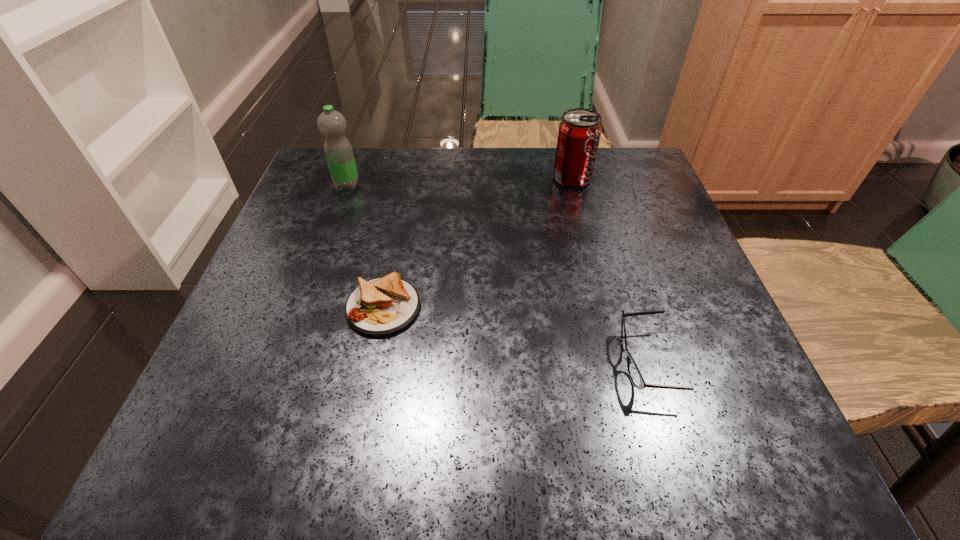
You are a GUI agent. You are given a task and a screenshot of the screen. Output one action in this format:
    pyautogui.click(x=<x>, y=<y>)
    Task: Click on the free space located on the front-facing side of the spectacles
    
    Given the screenshot: What is the action you would take?
    pyautogui.click(x=456, y=362)

At what (x,y) coordinates should I click in order to perform the action: click on free region located on the right of the shortest object. Please return your answer as a coordinate pair (x, y). Looking at the image, I should click on (488, 308).

Where is `water bottle that is at the far edge`? This screenshot has height=540, width=960. water bottle that is at the far edge is located at coordinates (332, 124).

Locate an element on the screen. This screenshot has height=540, width=960. pop soda at the far edge is located at coordinates [579, 132].

Image resolution: width=960 pixels, height=540 pixels. In order to click on object present at the left edge in this screenshot , I will do `click(332, 124)`.

Find the location of a particular element. The height and width of the screenshot is (540, 960). pop soda situated at the right edge is located at coordinates (579, 132).

Where is `spectacles positioned at the right edge`? The width and height of the screenshot is (960, 540). spectacles positioned at the right edge is located at coordinates (635, 375).

Locate an element on the screen. The image size is (960, 540). object at the far left corner is located at coordinates (332, 124).

I want to click on object that is at the far right corner, so click(x=579, y=132).

The image size is (960, 540). In order to click on vacant area at the far edge of the desktop in this screenshot , I will do `click(454, 163)`.